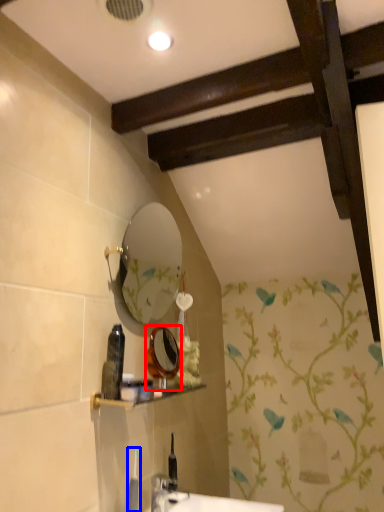
Question: Which point is closer to the camera, mirror (highlighted by a red box) or toiletry (highlighted by a blue box)?

Choices:
 (A) mirror
 (B) toiletry

Answer: (B)